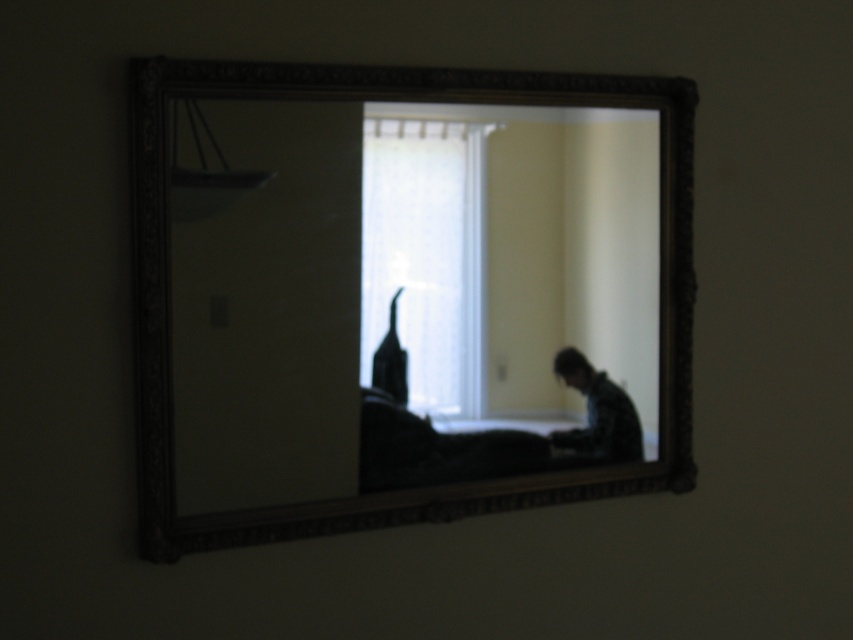
Can you confirm if wooden frame mirror at center is taller than white sheer curtain at center?

Yes, wooden frame mirror at center is taller than white sheer curtain at center.

Is wooden frame mirror at center above white sheer curtain at center?

Actually, wooden frame mirror at center is below white sheer curtain at center.

The image size is (853, 640). What do you see at coordinates (403, 294) in the screenshot? I see `wooden frame mirror at center` at bounding box center [403, 294].

This screenshot has width=853, height=640. Identify the location of wooden frame mirror at center. (403, 294).